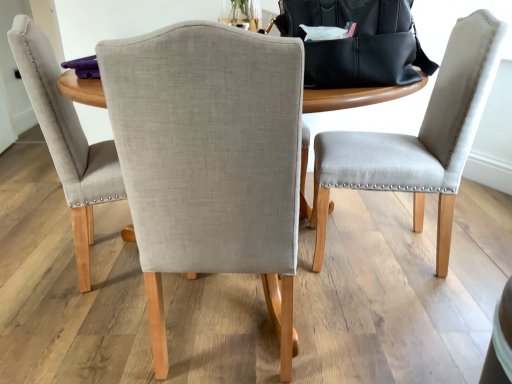
Where is `free space underneath light gray fabric chair at center, arranged as the 3th chair when viewed from the right (from a real-world perspective)`? free space underneath light gray fabric chair at center, arranged as the 3th chair when viewed from the right (from a real-world perspective) is located at coordinates (109, 262).